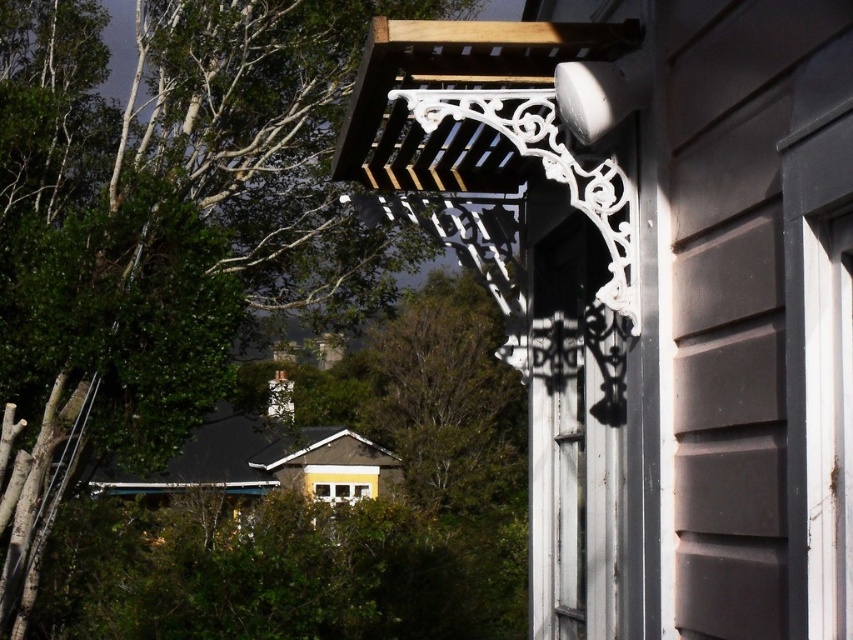
Question: Is white wrought iron pergola at upper center in front of green leafy tree at center?

Choices:
 (A) yes
 (B) no

Answer: (A)

Question: Which object is the closest to the green leafy tree at upper left?

Choices:
 (A) green leafy tree at center
 (B) white wrought iron pergola at upper center

Answer: (B)

Question: Is white wrought iron pergola at upper center bigger than green leafy tree at center?

Choices:
 (A) yes
 (B) no

Answer: (B)

Question: Which point is closer to the camera?

Choices:
 (A) green leafy tree at upper left
 (B) green leafy tree at center

Answer: (A)

Question: Does white wrought iron pergola at upper center appear under green leafy tree at upper left?

Choices:
 (A) no
 (B) yes

Answer: (A)

Question: Which object appears closest to the camera in this image?

Choices:
 (A) white wrought iron pergola at upper center
 (B) green leafy tree at upper left
 (C) green leafy tree at center

Answer: (A)